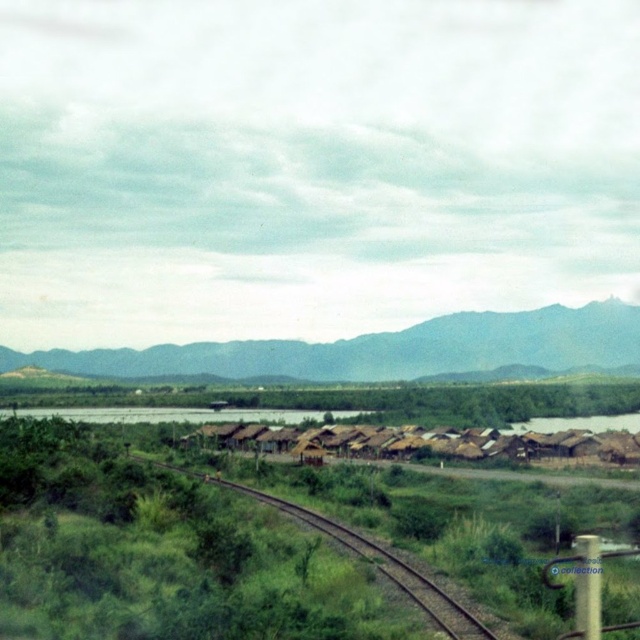
Question: Estimate the real-world distances between objects in this image. Which object is closer to the green grassy track at center?

Choices:
 (A) green grassy mountain at upper center
 (B) brown thatched-roof village at center

Answer: (B)

Question: Does green grassy mountain at upper center have a greater width compared to green grassy track at center?

Choices:
 (A) no
 (B) yes

Answer: (B)

Question: Which object appears farthest from the camera in this image?

Choices:
 (A) green grassy track at center
 (B) green grassy mountain at upper center

Answer: (B)

Question: Is brown thatched-roof village at center positioned before green grassy track at center?

Choices:
 (A) no
 (B) yes

Answer: (A)

Question: Can you confirm if green grassy mountain at upper center is wider than brown thatched-roof village at center?

Choices:
 (A) yes
 (B) no

Answer: (A)

Question: Which of the following is the closest to the observer?

Choices:
 (A) green grassy track at center
 (B) green grassy mountain at upper center

Answer: (A)